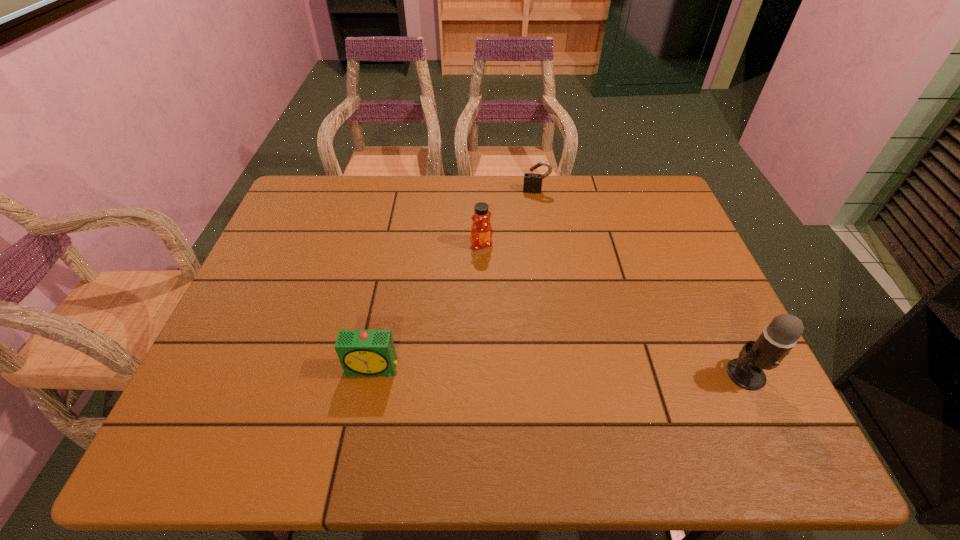
You are a GUI agent. You are given a task and a screenshot of the screen. Output one action in this format:
    pyautogui.click(x=<x>, y=<y>)
    Task: Click on the vacant region located on the front label of the second tallest object
    The width and height of the screenshot is (960, 540).
    Given the screenshot: What is the action you would take?
    pyautogui.click(x=511, y=289)

I want to click on blank area located 0.270m with the keyhole on the front of the third object from left to right, so click(531, 249).

Locate an element on the screen. The height and width of the screenshot is (540, 960). vacant space located 0.270m with the keyhole on the front of the third object from left to right is located at coordinates (531, 249).

Identify the location of vacant area situated 0.280m with the keyhole on the front of the third object from left to right. (531, 252).

The width and height of the screenshot is (960, 540). What are the coordinates of `object that is at the far edge` in the screenshot? It's located at (532, 181).

Find the location of `alarm clock present at the near edge`. alarm clock present at the near edge is located at coordinates (361, 352).

This screenshot has width=960, height=540. I want to click on microphone situated at the near edge, so click(x=778, y=338).

Where is `object that is at the right edge`? object that is at the right edge is located at coordinates (778, 338).

Where is `object that is at the near right corner`? object that is at the near right corner is located at coordinates (778, 338).

In the image, there is a desktop. Identify the location of vacant space at the far edge. (391, 178).